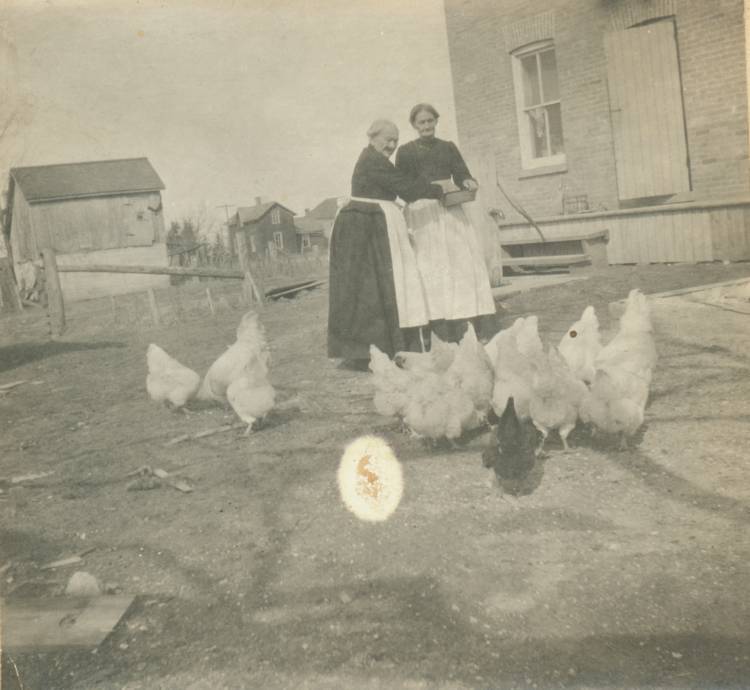
You are a GUI agent. You are given a task and a screenshot of the screen. Output one action in this format:
    pyautogui.click(x=<x>, y=<y>)
    Task: Click on the window
    
    Given the screenshot: What is the action you would take?
    pyautogui.click(x=546, y=137)